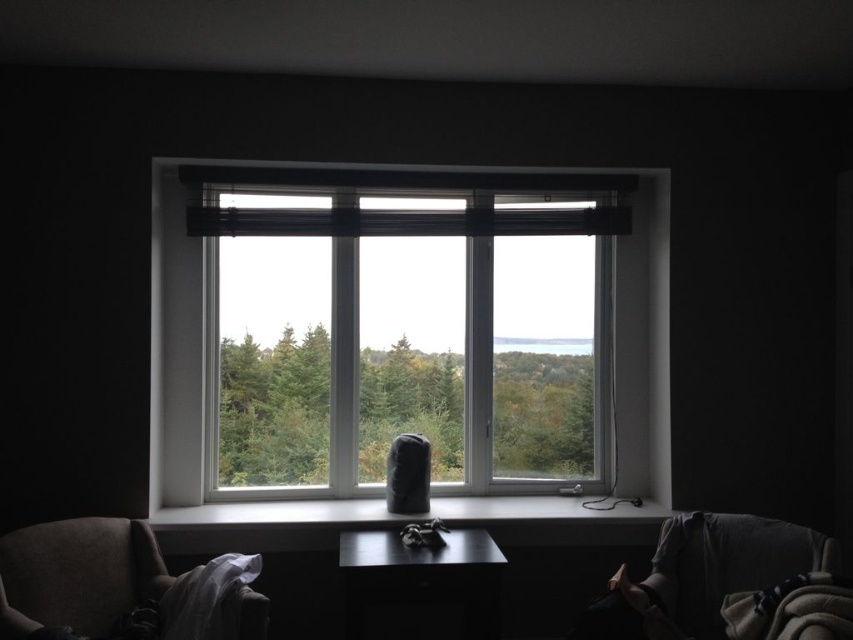
You are trying to place a large potted plant on the windowsill. The potted plant is wider than the window sill. Which object, the white plastic window at center or the white smooth window sill at center, should you place it on to ensure it fits?

The white plastic window at center might be wider than the white smooth window sill at center, so placing the potted plant on the white plastic window at center would be more likely to fit since it is wider.